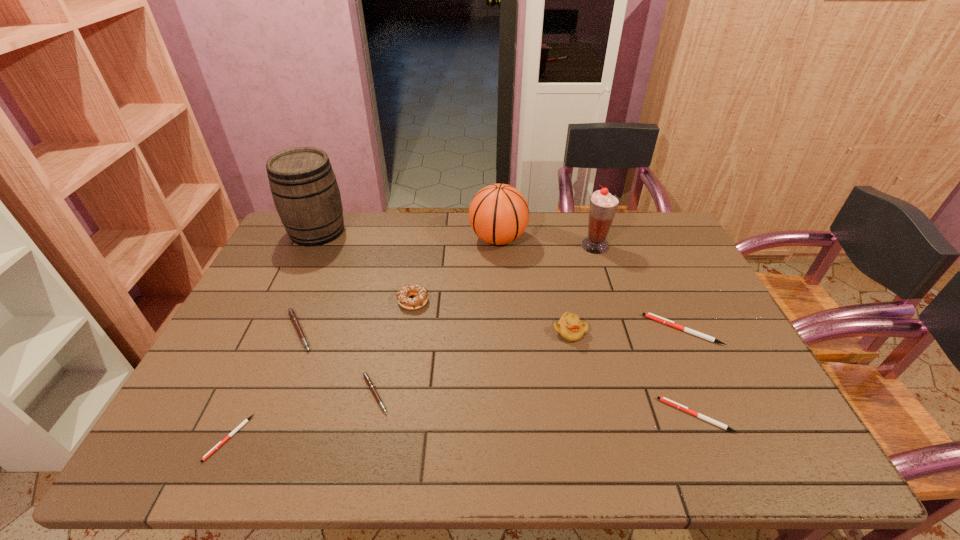
At what (x,y) coordinates should I click in order to perform the action: click on the biggest white pen. Please return your answer as a coordinate pair (x, y). The width and height of the screenshot is (960, 540). Looking at the image, I should click on (657, 318).

You are a GUI agent. You are given a task and a screenshot of the screen. Output one action in this format:
    pyautogui.click(x=<x>, y=<y>)
    Task: Click on the right pink pen
    
    Given the screenshot: What is the action you would take?
    pyautogui.click(x=368, y=380)

At what (x,y) coordinates should I click in order to perform the action: click on the smaller pink pen. Please return your answer as a coordinate pair (x, y). Looking at the image, I should click on (368, 380).

The image size is (960, 540). Find the location of `the second smallest white pen`. the second smallest white pen is located at coordinates (663, 399).

At what (x,y) coordinates should I click in order to perform the action: click on the shortest object. Please return your answer as a coordinate pair (x, y). Looking at the image, I should click on (245, 421).

At what (x,y) coordinates should I click in order to perform the action: click on the shortest pen. Please return your answer as a coordinate pair (x, y). Looking at the image, I should click on (245, 421).

Where is `vacant space located on the front of the tallest object`? vacant space located on the front of the tallest object is located at coordinates (300, 266).

You are a GUI agent. You are given a task and a screenshot of the screen. Output one action in this format:
    pyautogui.click(x=<x>, y=<y>)
    Task: Click on the free spot located on the left of the smoothie
    This screenshot has width=960, height=540.
    Given the screenshot: What is the action you would take?
    pyautogui.click(x=538, y=246)

You are a GUI agent. You are given a task and a screenshot of the screen. Output one action in this format:
    pyautogui.click(x=<x>, y=<y>)
    Task: Click on the blank space located on the left of the orange basketball
    The height and width of the screenshot is (540, 960).
    Given the screenshot: What is the action you would take?
    pyautogui.click(x=360, y=239)

This screenshot has width=960, height=540. Find the location of `blank space located at the beak of the duckling`. blank space located at the beak of the duckling is located at coordinates (594, 450).